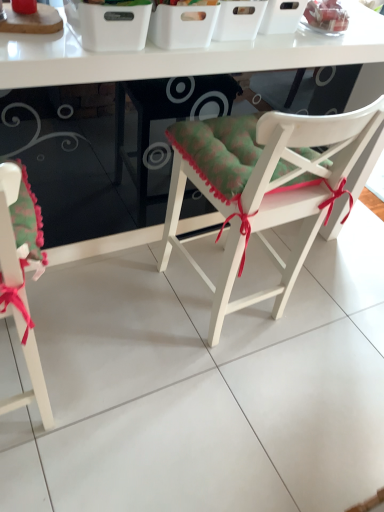
Question: Is white glossy table at center wider than white plastic basket at upper center?

Choices:
 (A) yes
 (B) no

Answer: (A)

Question: From the image's perspective, is white glossy table at center above white plastic basket at upper center?

Choices:
 (A) yes
 (B) no

Answer: (B)

Question: Considering the relative positions of white glossy table at center and white plastic basket at upper center in the image provided, is white glossy table at center to the left of white plastic basket at upper center from the viewer's perspective?

Choices:
 (A) no
 (B) yes

Answer: (B)

Question: Considering the relative sizes of white glossy table at center and white plastic basket at upper center in the image provided, is white glossy table at center shorter than white plastic basket at upper center?

Choices:
 (A) yes
 (B) no

Answer: (B)

Question: Does white glossy table at center come in front of white plastic basket at upper center?

Choices:
 (A) no
 (B) yes

Answer: (B)

Question: Considering the relative sizes of white glossy table at center and white plastic basket at upper center in the image provided, is white glossy table at center thinner than white plastic basket at upper center?

Choices:
 (A) yes
 (B) no

Answer: (B)

Question: Is matte green cushion at lower left, acting as the 2th chair starting from the right, smaller than white glossy table at center?

Choices:
 (A) no
 (B) yes

Answer: (B)

Question: Is matte green cushion at lower left, the 1th chair from the left, located outside white glossy table at center?

Choices:
 (A) no
 (B) yes

Answer: (B)

Question: Can you confirm if matte green cushion at lower left, acting as the 2th chair starting from the right, is bigger than white glossy table at center?

Choices:
 (A) yes
 (B) no

Answer: (B)

Question: Considering the relative positions of matte green cushion at lower left, acting as the 2th chair starting from the right, and white glossy table at center in the image provided, is matte green cushion at lower left, acting as the 2th chair starting from the right, to the left of white glossy table at center from the viewer's perspective?

Choices:
 (A) yes
 (B) no

Answer: (A)

Question: From the image's perspective, is matte green cushion at lower left, acting as the 2th chair starting from the right, on white glossy table at center?

Choices:
 (A) yes
 (B) no

Answer: (B)

Question: Can white glossy table at center be found inside matte green cushion at lower left, the 1th chair from the left?

Choices:
 (A) yes
 (B) no

Answer: (B)

Question: Is white plastic basket at upper center closer to camera compared to matte green cushion at lower left, acting as the 2th chair starting from the right?

Choices:
 (A) yes
 (B) no

Answer: (B)